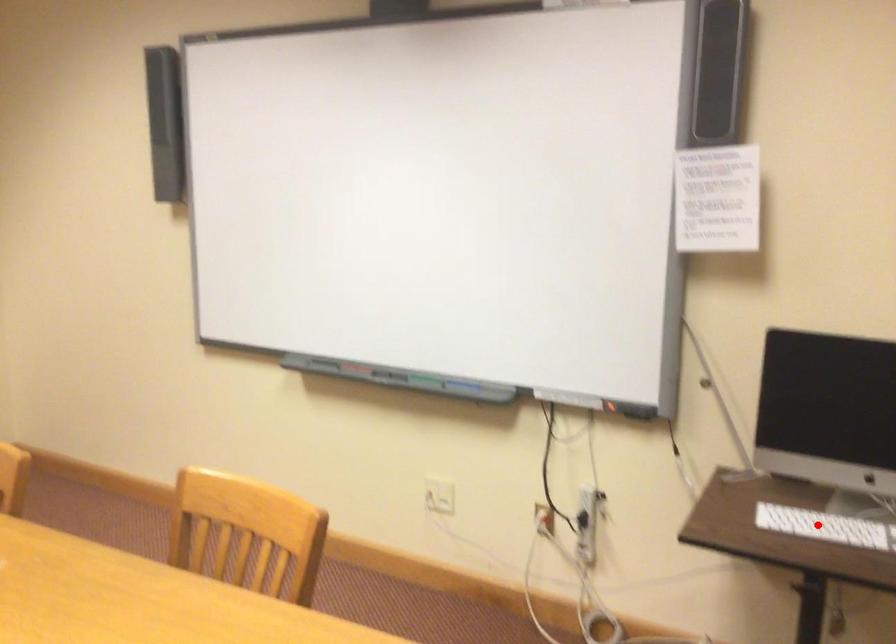
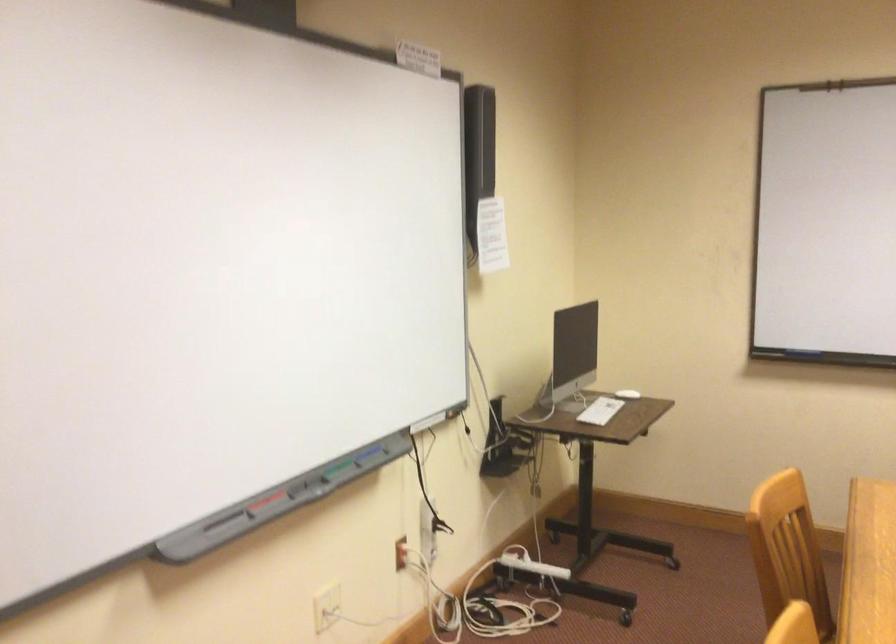
The point at the highlighted location is marked in the first image. Where is the corresponding point in the second image?

(600, 410)